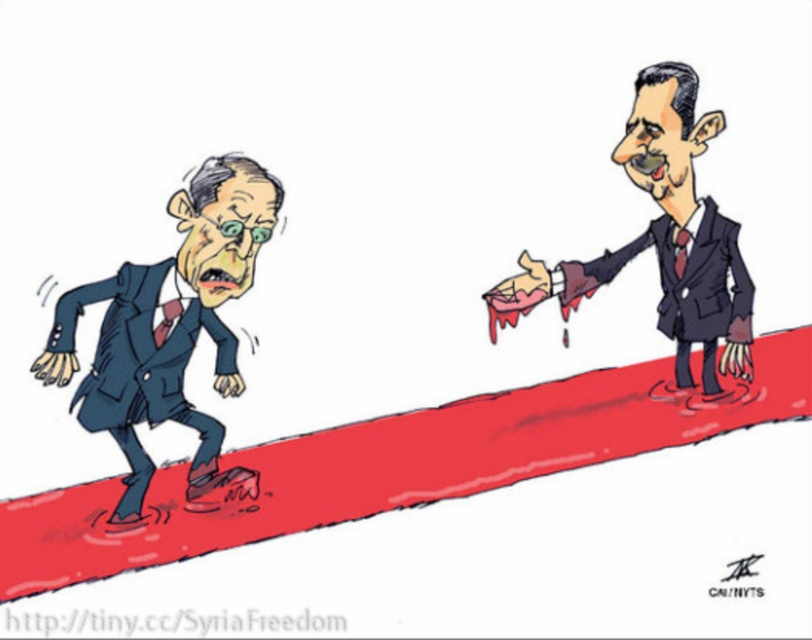
You are a photographer standing at the camera position. You want to take a closeup shot of the matte blue suit at left. Can you estimate how far you need to move forward to get the subject to fill the frame, assuming your camera has a standard 50mm lens and the subject needs to be 80cm away for a proper closeup?

The matte blue suit at left is currently 4.44 meters away. To achieve a closeup requiring the subject to be 80cm away, you need to move forward by 4.44 meters minus 0.8 meters, which equals 3.64 meters closer.

You are an observer analyzing the political cartoon. You notice the smooth suit at upper right and the dark blue suit at right. Which of these two suits is taller in the image?

The smooth suit at upper right is much taller than the dark blue suit at right.

Based on the coordinates provided, which object in the scene is positioned at point (169,328)?

The matte blue suit at left is positioned at point (169,328).